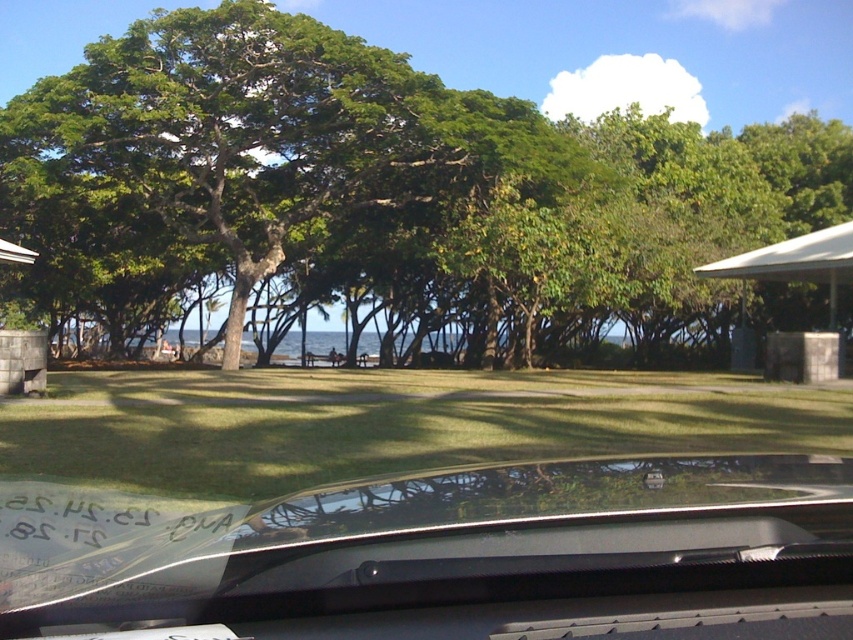
Can you confirm if green leafy tree at center is thinner than transparent glass windshield at lower center?

In fact, green leafy tree at center might be wider than transparent glass windshield at lower center.

Does green leafy tree at center appear over transparent glass windshield at lower center?

Yes, green leafy tree at center is above transparent glass windshield at lower center.

Who is more distant from viewer, (395, 188) or (703, 556)?

Point (395, 188)

Image resolution: width=853 pixels, height=640 pixels. I want to click on green leafy tree at center, so (x=384, y=188).

Does point (838, 500) come closer to viewer compared to point (202, 419)?

That is True.

Is transparent glass windshield at lower center to the right of green grass at center from the viewer's perspective?

No, transparent glass windshield at lower center is not to the right of green grass at center.

Which is in front, point (196, 513) or point (738, 416)?

Point (196, 513) is more forward.

The height and width of the screenshot is (640, 853). I want to click on transparent glass windshield at lower center, so click(457, 557).

Which is in front, point (462, 524) or point (807, 266)?

Point (462, 524) is more forward.

Which is more to the left, transparent glass windshield at lower center or white plastic gazebo at right?

Positioned to the left is transparent glass windshield at lower center.

Who is more forward, (80, 582) or (801, 243)?

Point (80, 582) is in front.

Find the location of a particular element. transparent glass windshield at lower center is located at coordinates (457, 557).